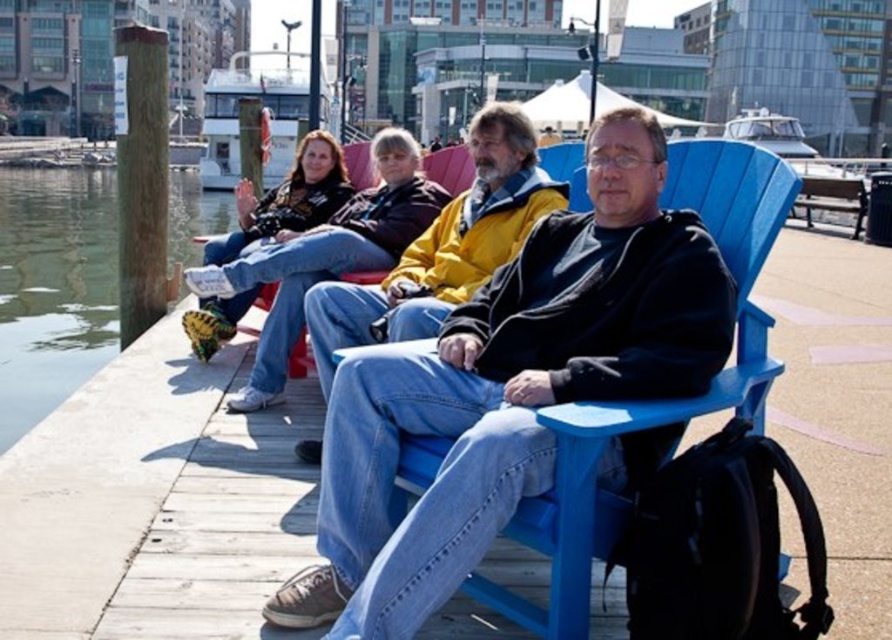
Question: Which object is closer to the camera taking this photo?

Choices:
 (A) yellow matte jacket at center
 (B) clear water at dock left
 (C) matte black jacket at center

Answer: (C)

Question: Which point appears closest to the camera in this image?

Choices:
 (A) (335, 384)
 (B) (530, 148)

Answer: (A)

Question: Can you confirm if matte black jacket at center is positioned below yellow matte jacket at center?

Choices:
 (A) yes
 (B) no

Answer: (A)

Question: Is matte black jacket at center to the left of yellow matte jacket at center from the viewer's perspective?

Choices:
 (A) no
 (B) yes

Answer: (A)

Question: Is matte black jacket at center positioned at the back of yellow matte jacket at center?

Choices:
 (A) no
 (B) yes

Answer: (A)

Question: Which point is closer to the camera?

Choices:
 (A) clear water at dock left
 (B) yellow matte jacket at center
 (C) matte black jacket at center

Answer: (C)